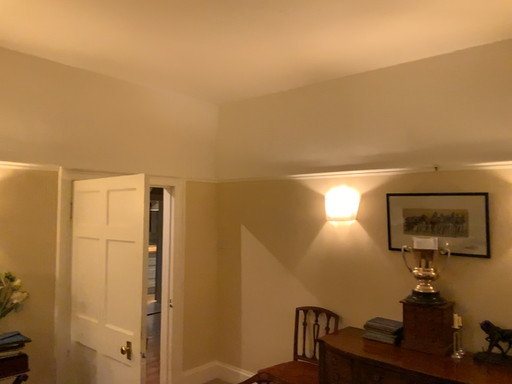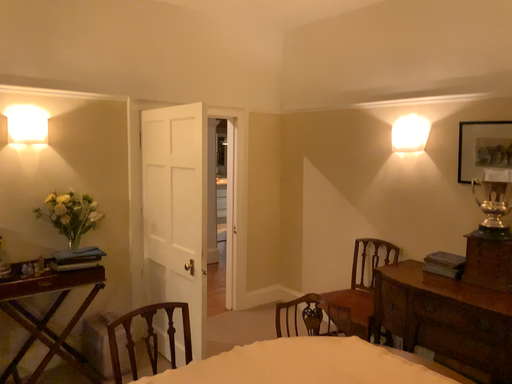
Question: How did the camera likely rotate when shooting the video?

Choices:
 (A) rotated upward
 (B) rotated downward

Answer: (B)